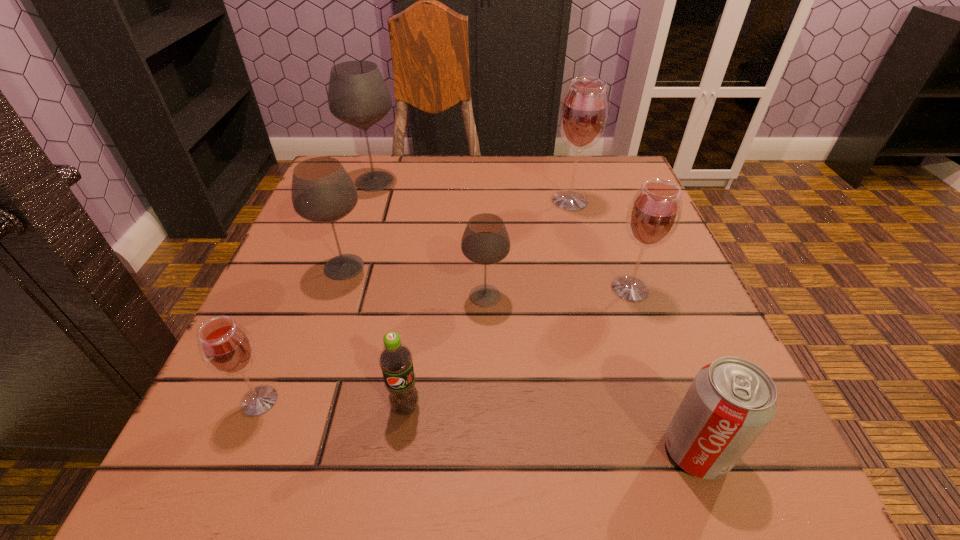
In order to click on vacant space at the far right corner in this screenshot , I will do `click(602, 167)`.

In the image, there is a desktop. Identify the location of free space at the near right corner. (768, 436).

Where is `unoccupied position between the fifth object from right to left and the nearer soda can`? unoccupied position between the fifth object from right to left and the nearer soda can is located at coordinates (551, 429).

Identify the location of vacant area that lies between the right soda can and the farther soda can. (551, 429).

I want to click on free spot between the nearest wineglass and the left soda can, so click(x=332, y=404).

Find the location of `free spot between the second biggest red wineglass and the farthest red wineglass`. free spot between the second biggest red wineglass and the farthest red wineglass is located at coordinates (600, 245).

I want to click on vacant area between the farther soda can and the biggest gray wineglass, so click(390, 294).

Where is `free spot between the farthest red wineglass and the biggest gray wineglass`? free spot between the farthest red wineglass and the biggest gray wineglass is located at coordinates (472, 191).

Find the location of a particular element. vacant region between the nearest object and the second biggest gray wineglass is located at coordinates (520, 359).

The width and height of the screenshot is (960, 540). I want to click on blank region between the second smallest gray wineglass and the biggest red wineglass, so click(x=457, y=234).